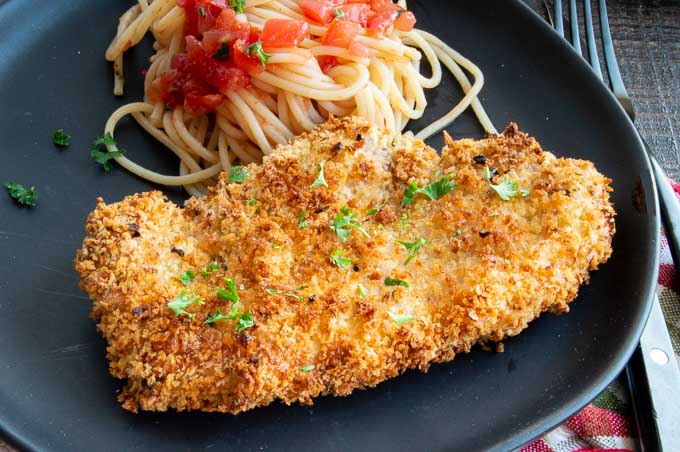
You are a GUI agent. You are given a task and a screenshot of the screen. Output one action in this format:
    pyautogui.click(x=<x>, y=<y>)
    Task: Click on the fork
    The height and width of the screenshot is (452, 680).
    Given the screenshot: What is the action you would take?
    pyautogui.click(x=664, y=201)